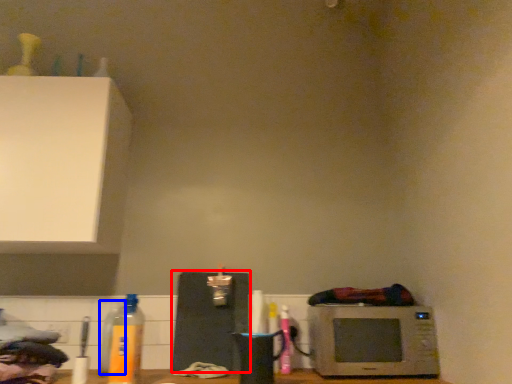
Question: Among these objects, which one is nearest to the camera, appliance (highlighted by a red box) or bottle (highlighted by a blue box)?

Choices:
 (A) appliance
 (B) bottle

Answer: (B)